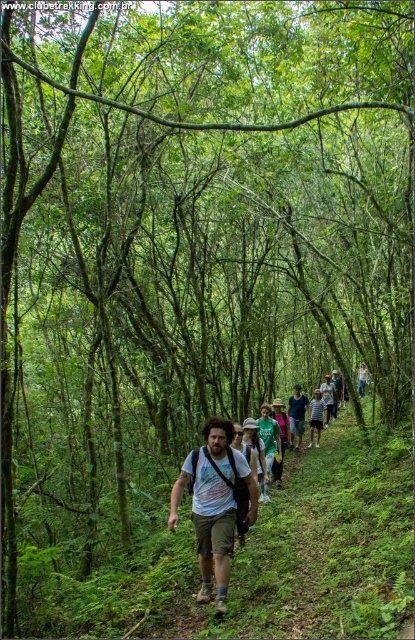
In the forest scene, there are two people wearing light brown cotton shorts at center and light blue cotton shirt at center. Which clothing item is positioned to the left?

The light brown cotton shorts at center is to the left of light blue cotton shirt at center.

You are a hiker trying to pack your backpack efficiently. You have both the light brown cotton shorts at center and the light blue cotton shirt at center. Which item takes up more space in your backpack?

The light brown cotton shorts at center is bigger than the light blue cotton shirt at center, so it takes up more space in the backpack.